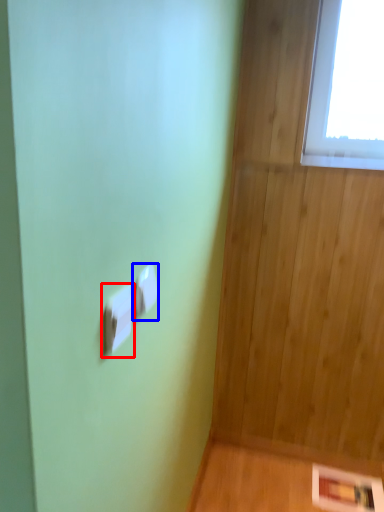
Question: Which of the following is the farthest to the observer, light switch (highlighted by a red box) or light switch (highlighted by a blue box)?

Choices:
 (A) light switch
 (B) light switch

Answer: (B)